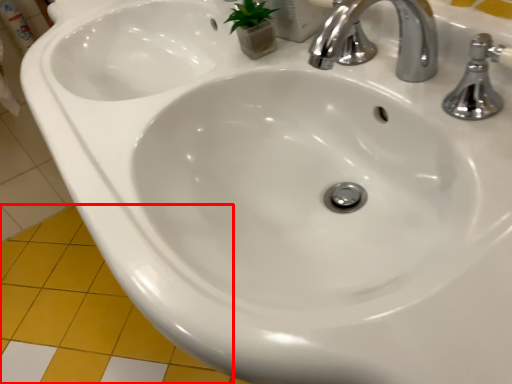
Question: From the image's perspective, considering the relative positions of ceramic tile (annotated by the red box) and tap in the image provided, where is ceramic tile (annotated by the red box) located with respect to the staircase?

Choices:
 (A) above
 (B) below

Answer: (B)